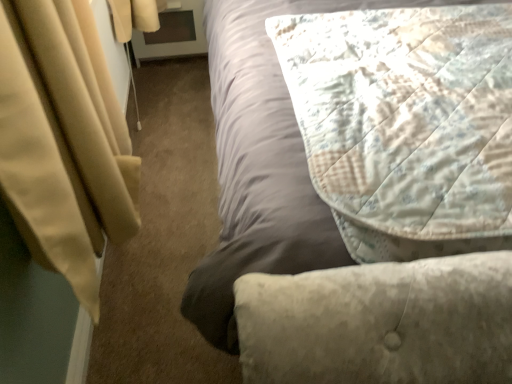
Question: Is quilted fabric bed at center inside quilted fabric pillow at upper right?

Choices:
 (A) yes
 (B) no

Answer: (B)

Question: Is quilted fabric pillow at upper right placed right next to quilted fabric bed at center?

Choices:
 (A) no
 (B) yes

Answer: (A)

Question: Considering the relative positions of quilted fabric pillow at upper right and quilted fabric bed at center in the image provided, is quilted fabric pillow at upper right to the left of quilted fabric bed at center from the viewer's perspective?

Choices:
 (A) yes
 (B) no

Answer: (A)

Question: From a real-world perspective, is quilted fabric pillow at upper right on quilted fabric bed at center?

Choices:
 (A) yes
 (B) no

Answer: (A)

Question: Considering the relative sizes of quilted fabric pillow at upper right and quilted fabric bed at center in the image provided, is quilted fabric pillow at upper right wider than quilted fabric bed at center?

Choices:
 (A) yes
 (B) no

Answer: (B)

Question: From a real-world perspective, is quilted fabric pillow at upper right located beneath quilted fabric bed at center?

Choices:
 (A) no
 (B) yes

Answer: (A)

Question: Is quilted fabric bed at center shorter than quilted fabric pillow at upper right?

Choices:
 (A) no
 (B) yes

Answer: (A)

Question: Is quilted fabric pillow at upper right at the back of quilted fabric bed at center?

Choices:
 (A) yes
 (B) no

Answer: (B)

Question: Is quilted fabric bed at center directly adjacent to quilted fabric pillow at upper right?

Choices:
 (A) no
 (B) yes

Answer: (A)

Question: Can you confirm if quilted fabric bed at center is taller than quilted fabric pillow at upper right?

Choices:
 (A) yes
 (B) no

Answer: (A)

Question: From the image's perspective, is quilted fabric bed at center located above quilted fabric pillow at upper right?

Choices:
 (A) yes
 (B) no

Answer: (A)

Question: Is quilted fabric bed at center bigger than quilted fabric pillow at upper right?

Choices:
 (A) no
 (B) yes

Answer: (B)

Question: Which is correct: quilted fabric bed at center is inside quilted fabric pillow at upper right, or outside of it?

Choices:
 (A) outside
 (B) inside

Answer: (A)